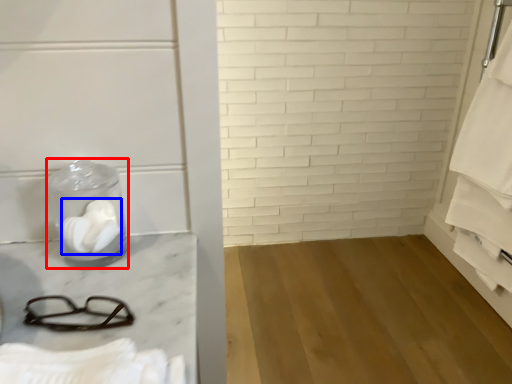
Question: Which object is further to the camera taking this photo, glass jar (highlighted by a red box) or toilet paper (highlighted by a blue box)?

Choices:
 (A) glass jar
 (B) toilet paper

Answer: (B)